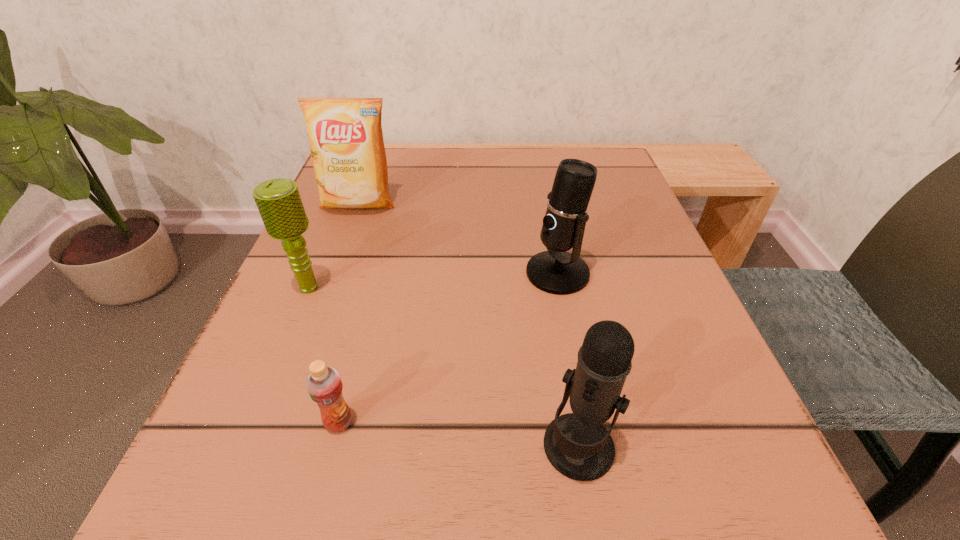
Where is `vacant space that satisfies the following two spatial constraints: 1. on the front-facing side of the nearest microphone; 2. on the right side of the crisp (potato chip)`? This screenshot has height=540, width=960. vacant space that satisfies the following two spatial constraints: 1. on the front-facing side of the nearest microphone; 2. on the right side of the crisp (potato chip) is located at coordinates (268, 447).

You are a GUI agent. You are given a task and a screenshot of the screen. Output one action in this format:
    pyautogui.click(x=<x>, y=<y>)
    Task: Click on the free space that satisfies the following two spatial constraints: 1. on the front-facing side of the crisp (potato chip); 2. on the right side of the orange juice
    
    Given the screenshot: What is the action you would take?
    pyautogui.click(x=277, y=422)